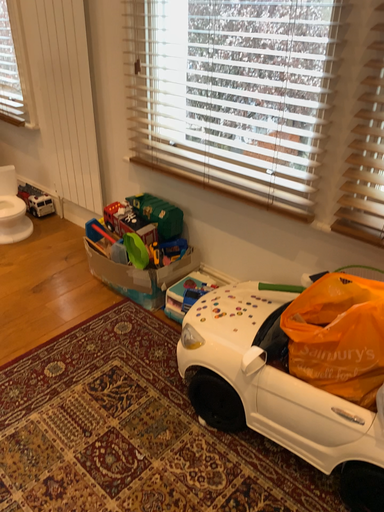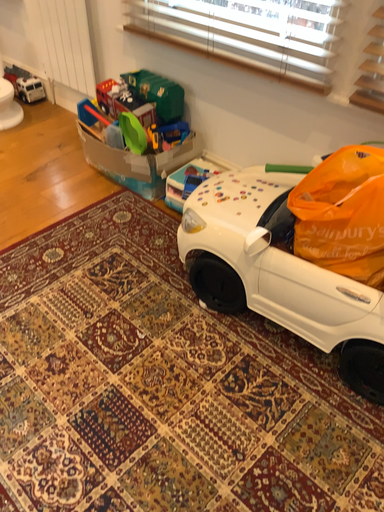
Question: How did the camera likely rotate when shooting the video?

Choices:
 (A) rotated upward
 (B) rotated downward

Answer: (B)